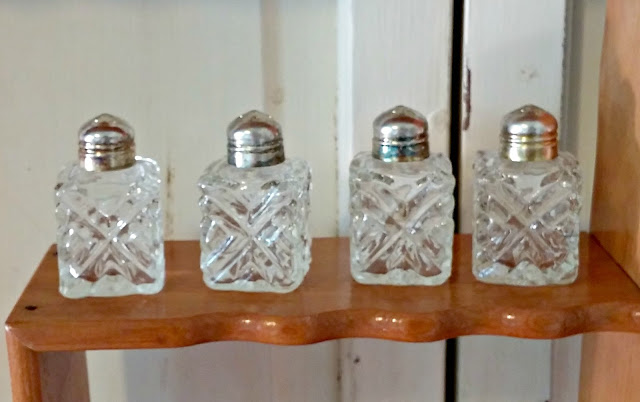
This screenshot has width=640, height=402. I want to click on bottle, so click(x=90, y=209), click(x=259, y=238), click(x=388, y=220), click(x=505, y=220).